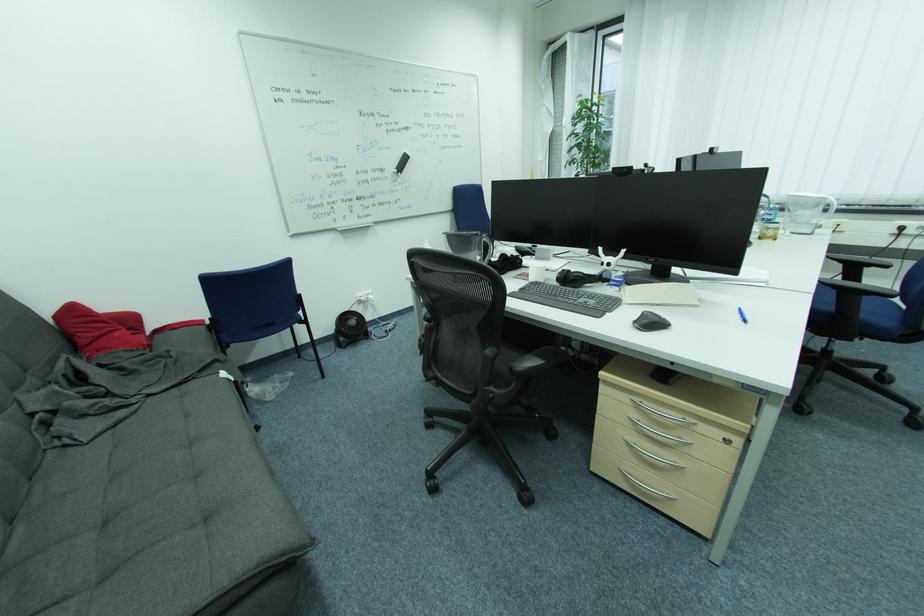
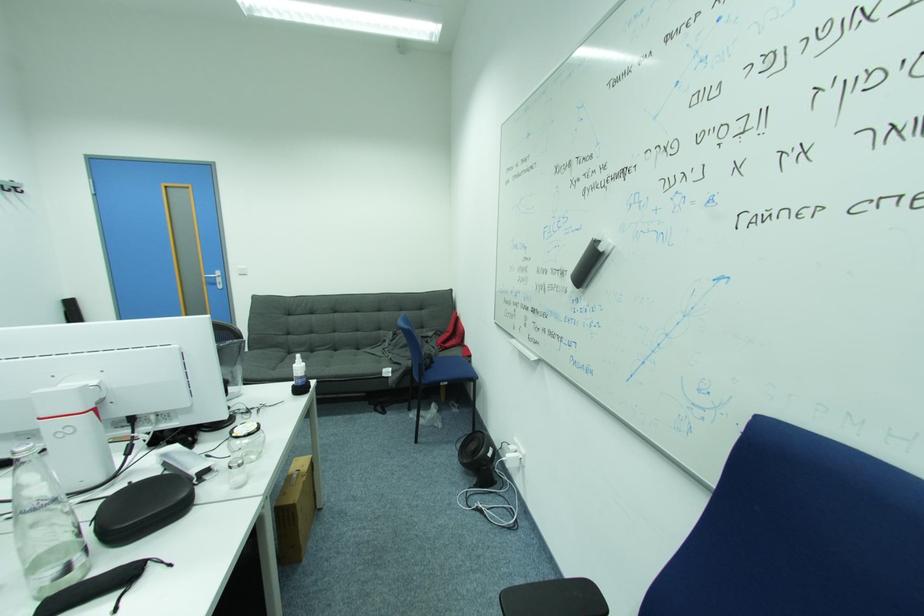
Find the pixel in the second image that matches point (391, 172) in the first image.

(572, 277)